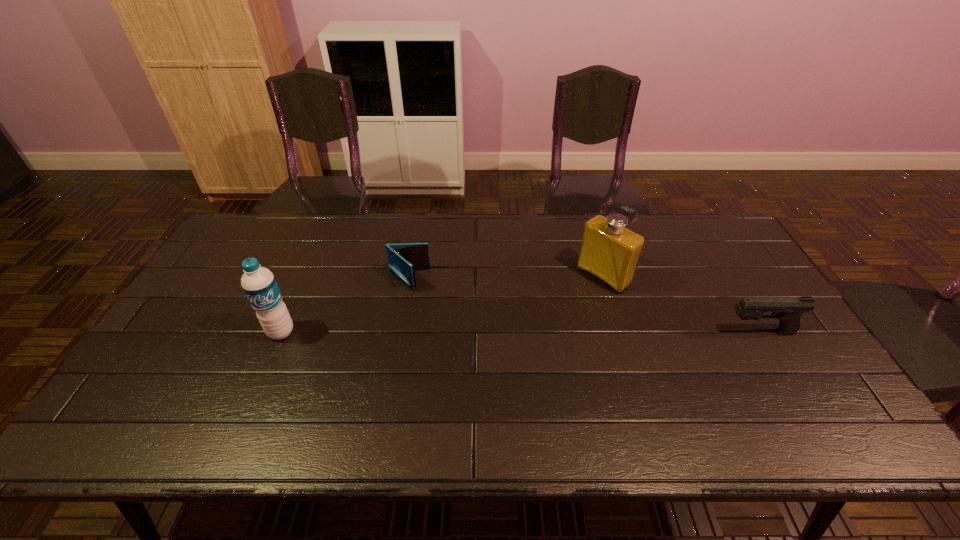
This screenshot has height=540, width=960. I want to click on water bottle, so click(258, 283).

You are a GUI agent. You are given a task and a screenshot of the screen. Output one action in this format:
    pyautogui.click(x=<x>, y=<y>)
    Task: Click on the rightmost object
    
    Given the screenshot: What is the action you would take?
    pyautogui.click(x=789, y=310)

This screenshot has width=960, height=540. What are the coordinates of `the third tallest object` in the screenshot? It's located at (789, 310).

You are a GUI agent. You are given a task and a screenshot of the screen. Output one action in this format:
    pyautogui.click(x=<x>, y=<y>)
    Task: Click on the wallet
    The width and height of the screenshot is (960, 540).
    Given the screenshot: What is the action you would take?
    pyautogui.click(x=404, y=258)

Locate an element on the screen. This screenshot has height=540, width=960. the second object from left to right is located at coordinates tap(404, 258).

Where is `perfume`? The width and height of the screenshot is (960, 540). perfume is located at coordinates (610, 252).

You are a GUI agent. You are given a task and a screenshot of the screen. Output one action in this format:
    pyautogui.click(x=<x>, y=<y>)
    Task: Click on the vacant space located 0.150m on the label of the water bottle
    This screenshot has width=960, height=540.
    Given the screenshot: What is the action you would take?
    [x=255, y=392]

Find the location of `vacant region located 0.330m at the barrel of the pistol`. vacant region located 0.330m at the barrel of the pistol is located at coordinates (604, 332).

Where is `vacant position located 0.200m at the barrel of the pistol`? vacant position located 0.200m at the barrel of the pistol is located at coordinates (652, 332).

Identify the location of free space located at the barrel of the pistol. This screenshot has width=960, height=540. (648, 332).